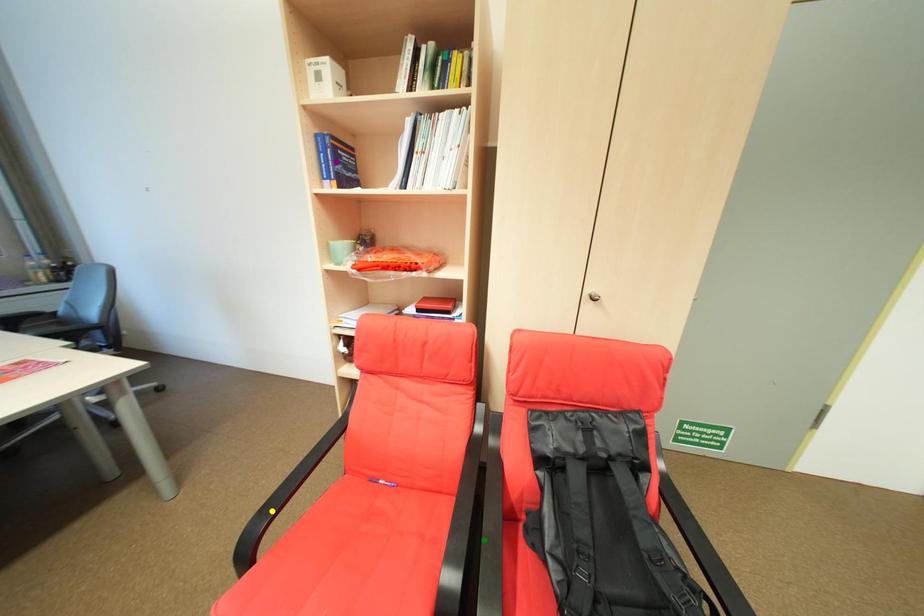
Order these from nearest to farthest:
purple point, yellow point, green point

yellow point
green point
purple point